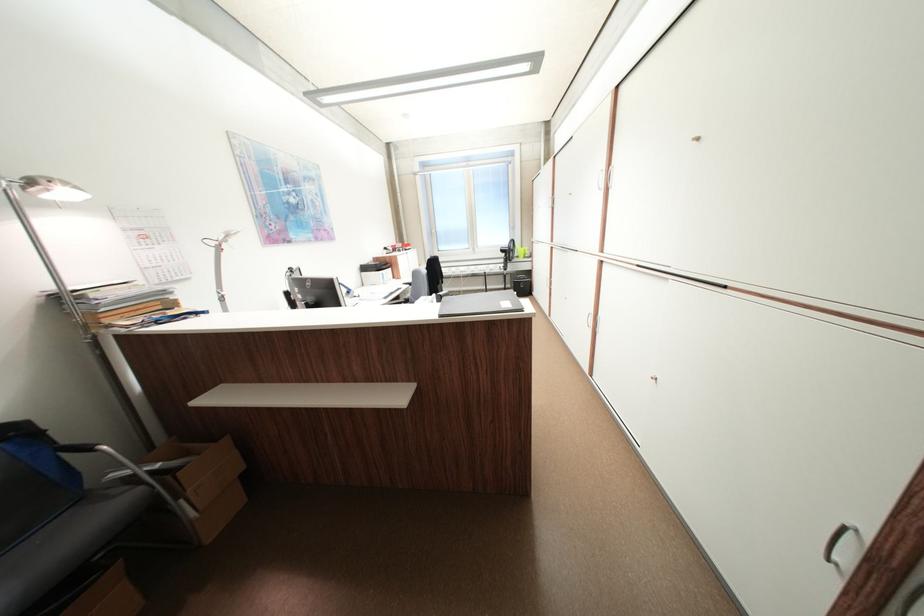
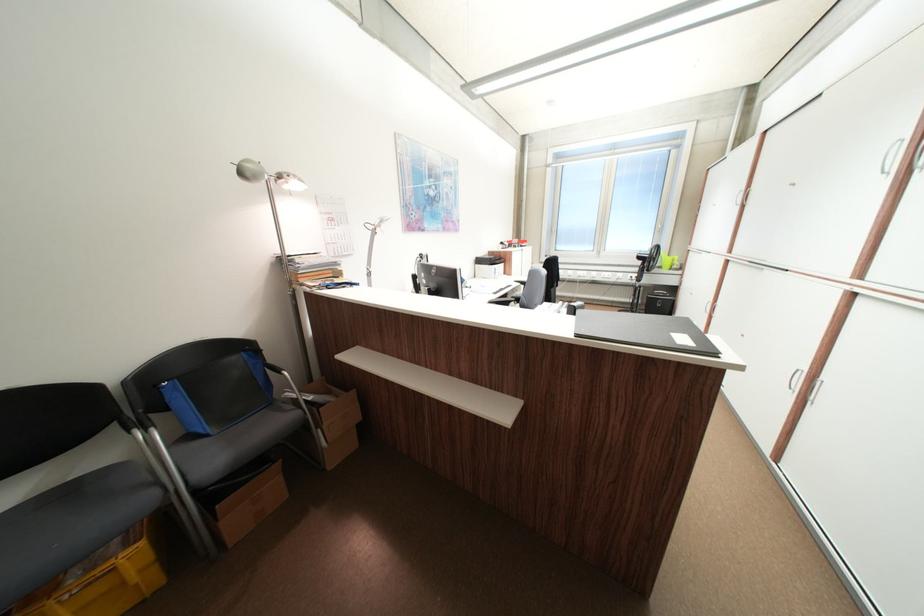
Question: The camera is either moving clockwise (left) or counter-clockwise (right) around the object. The first image is from the beginning of the video and the second image is from the end. Is the camera moving left or right when shooting the video?

Choices:
 (A) Left
 (B) Right

Answer: (B)